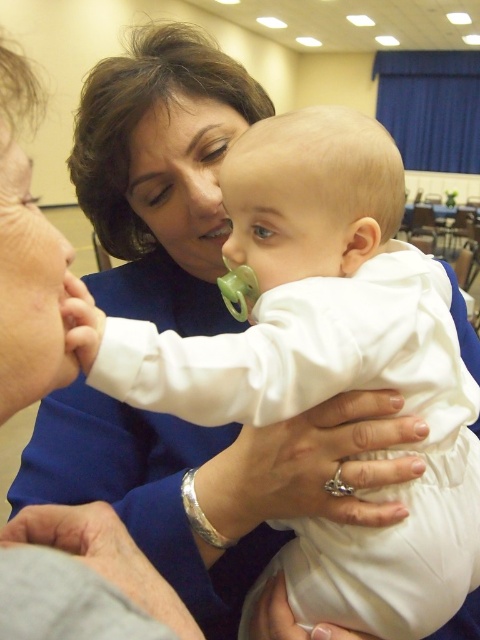
Question: Where is matte green pacifier at center located in relation to silver metallic teething ring at center in the image?

Choices:
 (A) below
 (B) above

Answer: (B)

Question: Which object appears closest to the camera in this image?

Choices:
 (A) silver metallic teething ring at center
 (B) white matte pacifier at center

Answer: (B)

Question: Does matte green pacifier at center have a greater width compared to silver metallic teething ring at center?

Choices:
 (A) no
 (B) yes

Answer: (B)

Question: Which object is farther from the camera taking this photo?

Choices:
 (A) white matte pacifier at center
 (B) silver metallic teething ring at center

Answer: (B)

Question: Does white matte pacifier at center have a lesser width compared to silver metallic teething ring at center?

Choices:
 (A) no
 (B) yes

Answer: (A)

Question: Which point is closer to the camera?

Choices:
 (A) (379, 236)
 (B) (335, 490)
 (C) (228, 230)

Answer: (A)